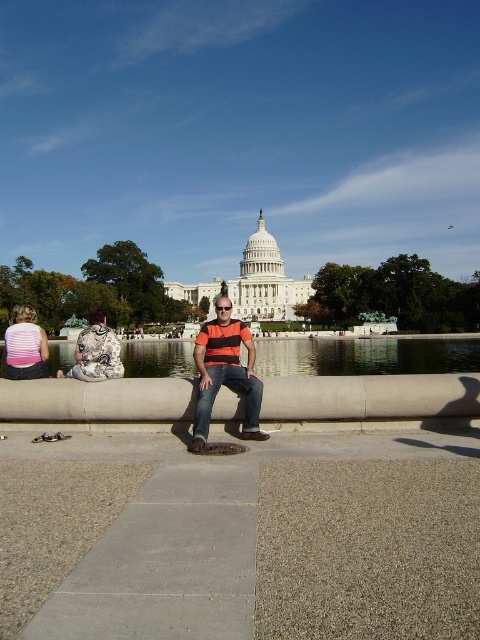
You are standing at the point marked by the coordinates point (365, 355) in the image of the U.S. Capitol. What is the object located at that point?

The point (365, 355) corresponds to clear glass water at center.

Looking at this image, you are planning to take a photo of the orange striped shirt at center and the clear glass water at center from the Reflecting Pool. If your camera has a maximum focus range of 25 meters, will you be able to capture both subjects in focus without moving closer?

The distance between the orange striped shirt at center and the clear glass water at center is 22.92 meters, which is within the camera maximum focus range of 25 meters. Therefore, you can capture both subjects in focus without moving closer.

You are standing at the Reflecting Pool and want to take a photo of the Capitol building. The clear glass water at center is in your way. Can you step back to get the Capitol building fully in your shot without the water obstructing it?

The clear glass water at center is 221.76 feet away from you. Since the distance is quite large, stepping back a few feet might not significantly affect the framing. However, moving back slightly could help reduce the prominence of the water in the foreground, allowing the Capitol building to be more centered in the photo. Alternatively, adjusting your angle or using a wider lens might be more effective solutions.